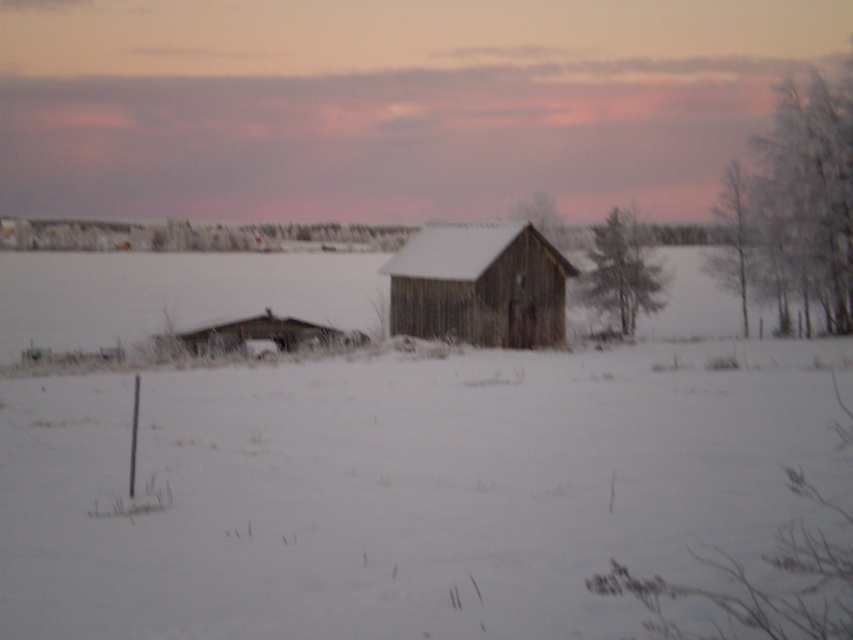
You are a photographer wanting to capture both the weathered wood barn at center and the green textured pine at center in the same frame. Based on their positions, which one would appear closer to the camera in the photo?

The weathered wood barn at center is located below the green textured pine at center, so in the photo, the weathered wood barn at center would appear closer to the camera since it is positioned lower in the frame.

You are standing at the origin point of the coordinate system in the winter landscape. You want to place a decorative snowman exactly at the location of the green textured pine at center. What are the coordinates where you should place the snowman?

The coordinates for the green textured pine at center are at point (622, 273). Therefore, you should place the snowman at coordinates (622, 273).

You are an architect analyzing the winter landscape. You need to determine which structure is shorter between the weathered wood barn at center and the smooth wooden house at center. Based on the scene, which one is shorter?

The weathered wood barn at center is not as tall as the smooth wooden house at center, so the weathered wood barn at center is shorter.